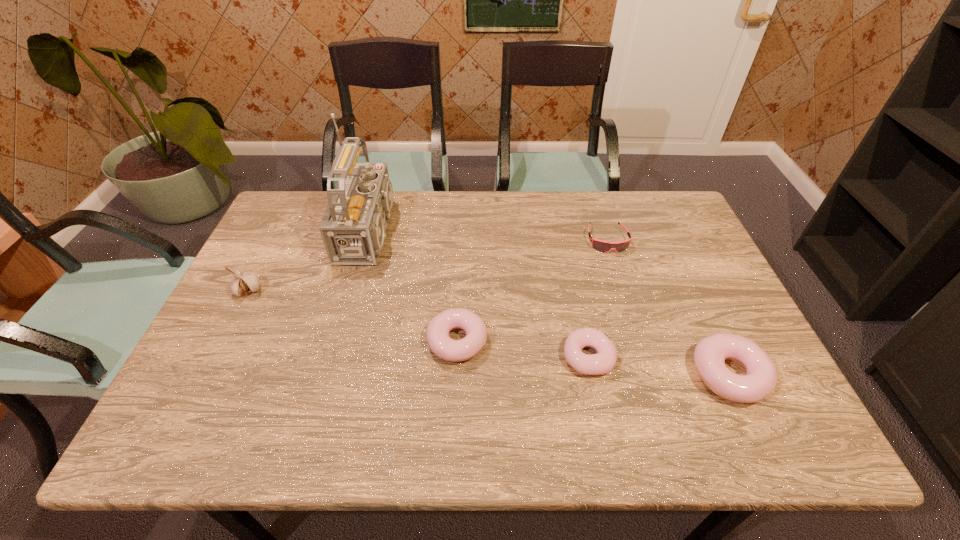
Identify the location of empty space between the goggles and the leftmost doughnut. coord(532,291).

Identify the location of empty space between the rightmost object and the goggles. The image size is (960, 540). (668, 307).

This screenshot has height=540, width=960. What are the coordinates of `vacant area that lies between the second object from right to left and the tallest object` in the screenshot? It's located at (492, 236).

Identify the location of empty space that is in between the second doughnut from left to right and the leftmost object. (419, 324).

Find the location of a particular element. blank region between the third object from left to right and the shortest doughnut is located at coordinates (523, 349).

The height and width of the screenshot is (540, 960). In order to click on vacant space that's between the shortest doughnut and the goggles in this screenshot , I will do `click(598, 299)`.

Locate an element on the screen. This screenshot has width=960, height=540. vacant region between the rightmost object and the fifth object from left to right is located at coordinates (668, 307).

The image size is (960, 540). I want to click on object that is the third closest one to the fourth nearest object, so pyautogui.click(x=603, y=362).

The image size is (960, 540). What are the coordinates of `object that stands as the closest to the garlic` in the screenshot? It's located at (353, 227).

This screenshot has width=960, height=540. Find the location of `doughnut that is the closest one to the rightmost doughnut`. doughnut that is the closest one to the rightmost doughnut is located at coordinates (603, 362).